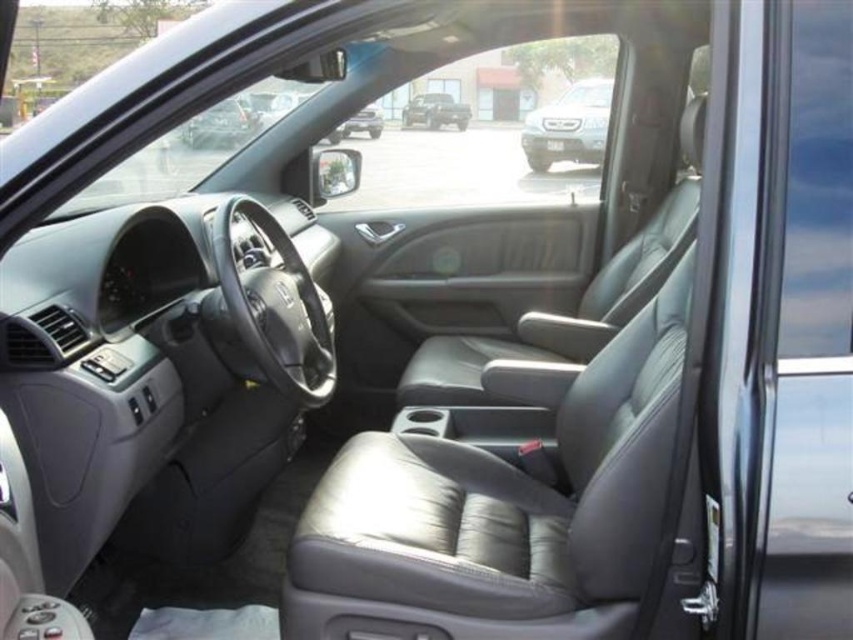
Between point (560, 108) and point (347, 132), which one is positioned in front?

Point (347, 132)

Between point (595, 88) and point (381, 125), which one is positioned in front?

Point (381, 125) is in front.

Where is `satin silver suv at center`? satin silver suv at center is located at coordinates (567, 125).

Can you confirm if matte black suv at center is positioned above matte black truck at center?

Correct, matte black suv at center is located above matte black truck at center.

Which is more to the right, matte black suv at center or matte black truck at center?

From the viewer's perspective, matte black suv at center appears more on the right side.

Find the location of `matte black suv at center`. matte black suv at center is located at coordinates (434, 112).

The image size is (853, 640). I want to click on matte black suv at center, so click(434, 112).

Which is more to the right, matte black car at upper left or matte black suv at center?

matte black suv at center is more to the right.

Consider the image. Can you confirm if matte black car at upper left is thinner than matte black suv at center?

Correct, matte black car at upper left's width is less than matte black suv at center's.

Which is behind, point (228, 115) or point (412, 112)?

The point (412, 112) is behind.

You are a GUI agent. You are given a task and a screenshot of the screen. Output one action in this format:
    pyautogui.click(x=<x>, y=<y>)
    Task: Click on the matte black car at upper left
    
    Given the screenshot: What is the action you would take?
    pyautogui.click(x=219, y=125)